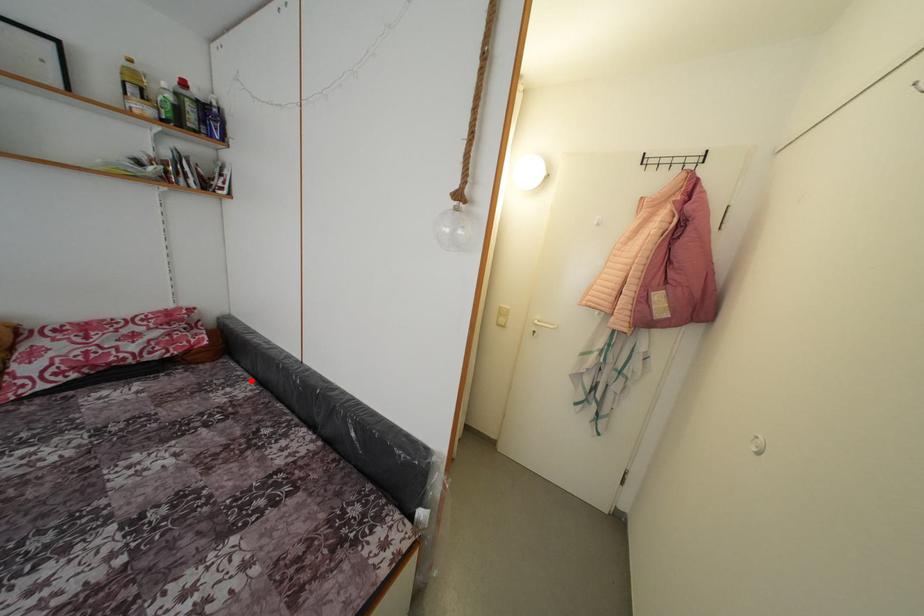
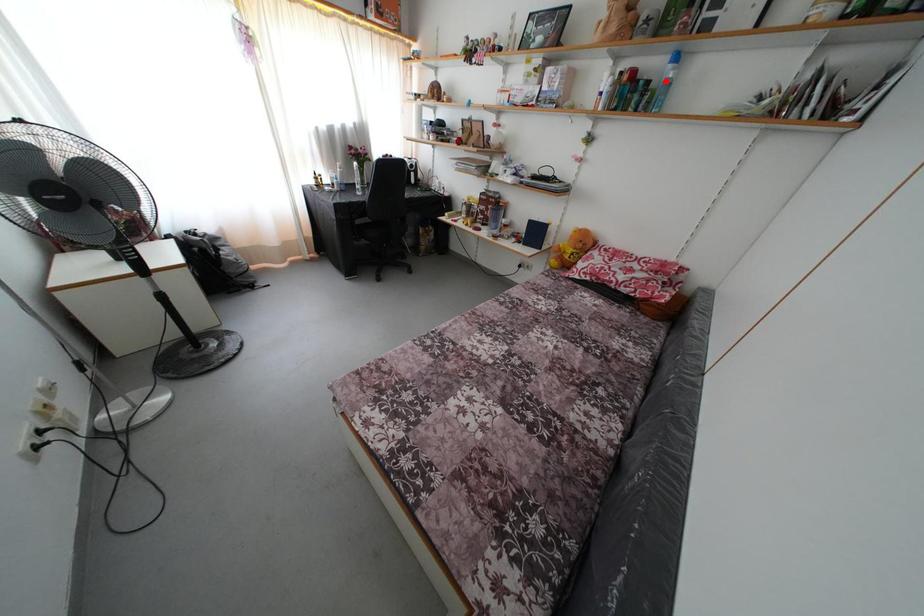
I am providing you with two images of the same scene from different viewpoints. A red point is marked on the first image and another point is marked on the second image. Does the point marked in image1 correspond to the same location as the one in image2?

No